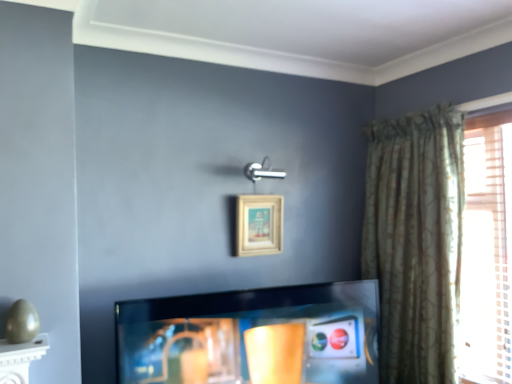
Question: Does point (365, 344) appear closer or farther from the camera than point (398, 284)?

Choices:
 (A) closer
 (B) farther

Answer: (A)

Question: Looking at the image, does shiny black tv at center seem bigger or smaller compared to green textured curtain at right?

Choices:
 (A) big
 (B) small

Answer: (B)

Question: Which object is the closest to the shiny black tv at center?

Choices:
 (A) green textured curtain at right
 (B) beige wooden picture frame at upper center

Answer: (B)

Question: Which object is the closest to the green textured curtain at right?

Choices:
 (A) shiny black tv at center
 (B) beige wooden picture frame at upper center

Answer: (A)